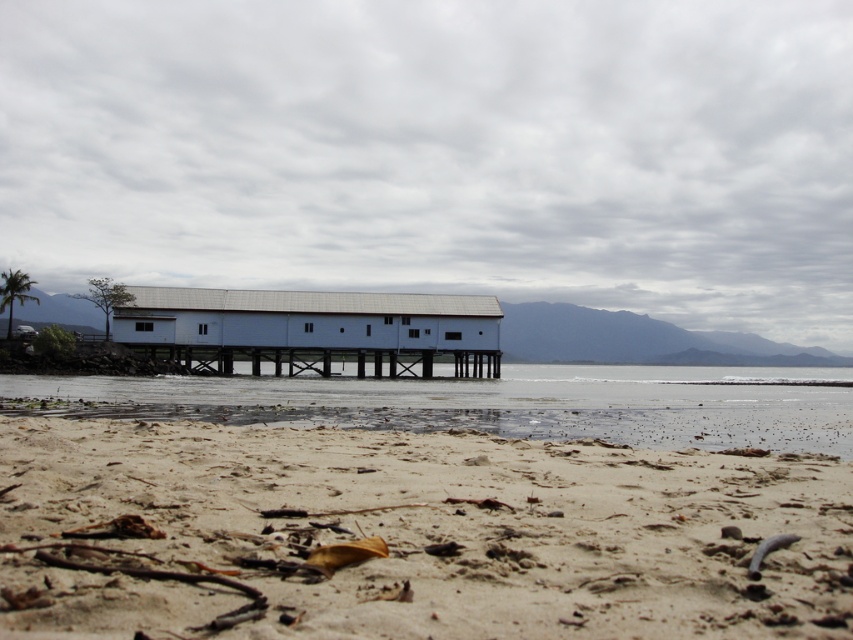
You are a photographer planning to capture the white matte wooden hut at center and the clear water at lower center in a single frame. Based on the scene, which object occupies a larger portion of the horizontal space in the image?

The clear water at lower center occupies a larger portion of the horizontal space since its width surpasses that of the white matte wooden hut at center.

You are standing on the beach in the coastal scene. You see a white building elevated on stilts. Where is the white matte wooden hut at center located relative to the point marked at coordinates (x=312, y=330)?

The point marked at coordinates (x=312, y=330) indicates the location of the white matte wooden hut at center.

You are standing on the beach looking towards the white building on stilts. There is a clear water area marked by point (492,403). If you want to reach the white building on stilts without getting your feet wet, should you walk towards the clear water area or away from it?

You should walk away from the clear water area marked by point (492,403). The clear water area is located at the lower center, which is closer to the shoreline. To avoid getting wet, you need to move towards the dry sand near the white building on stilts, which is further inland from the water.